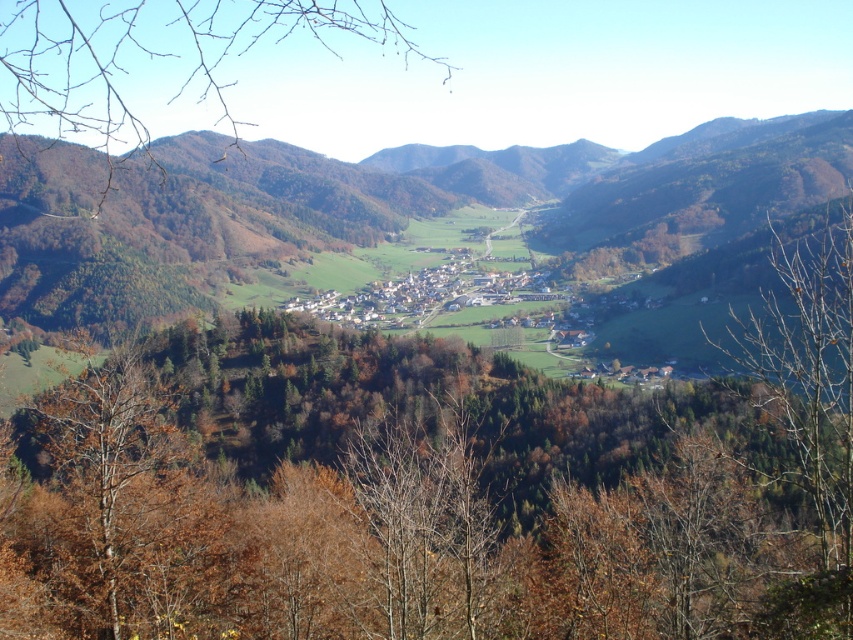
Measure the distance from brown leafy tree at center to brown leafy tree at left.

A distance of 1315.44 feet exists between brown leafy tree at center and brown leafy tree at left.

Is brown leafy tree at center closer to the viewer compared to brown leafy tree at left?

No.

At what (x,y) coordinates should I click in order to perform the action: click on brown leafy tree at center. Please return your answer as a coordinate pair (x, y). The width and height of the screenshot is (853, 640). Looking at the image, I should click on (386, 500).

Where is `brown leafy tree at center`? This screenshot has height=640, width=853. brown leafy tree at center is located at coordinates (386, 500).